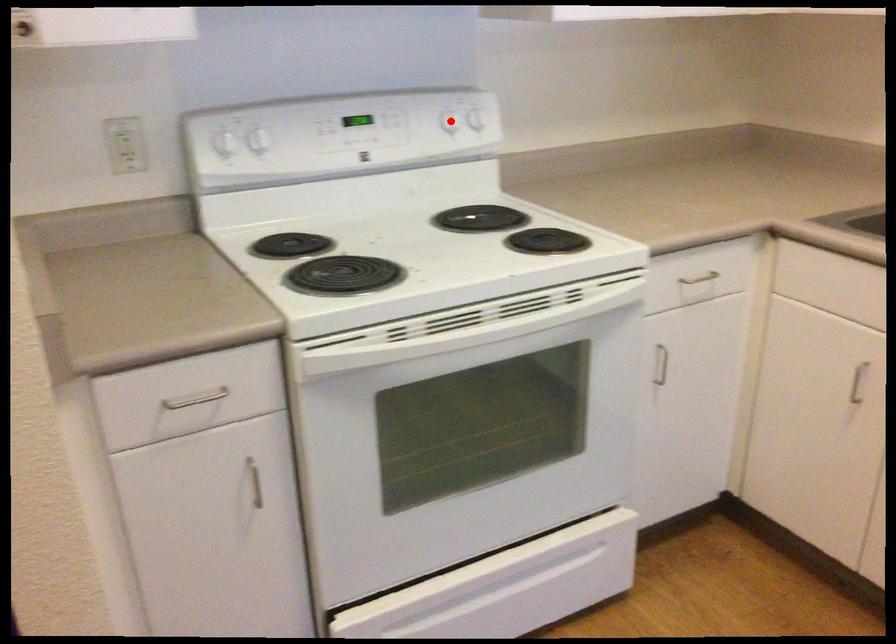
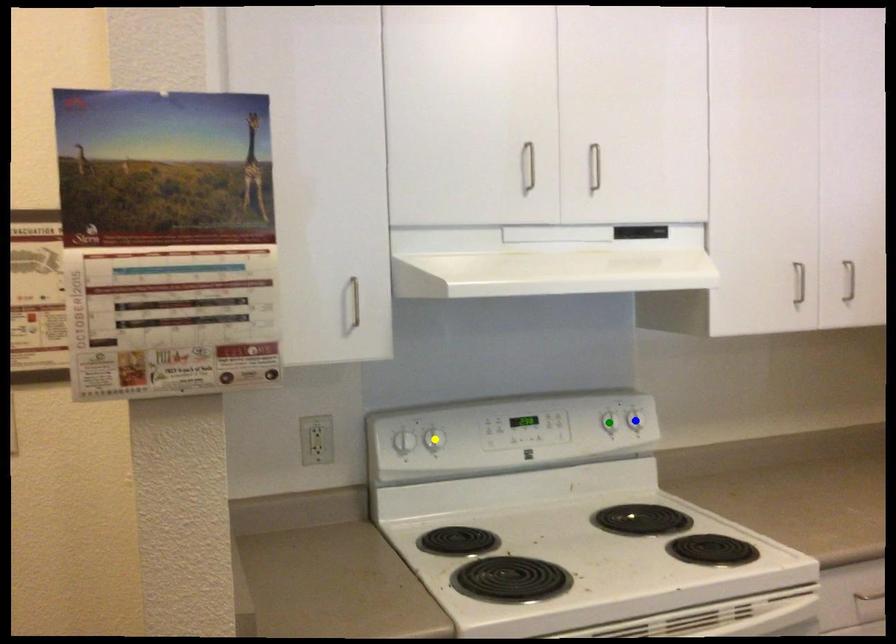
Question: I am providing you with two images of the same scene from different viewpoints. A red point is marked on the first image. You are given multiple points on the second image. Which point in image 2 is actually the same real-world point as the red point in image 1?

Choices:
 (A) blue point
 (B) green point
 (C) yellow point

Answer: (B)